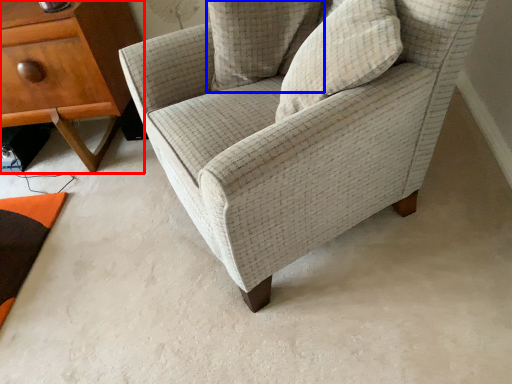
Question: Which object appears closest to the camera in this image, nightstand (highlighted by a red box) or pillow (highlighted by a blue box)?

Choices:
 (A) nightstand
 (B) pillow

Answer: (B)